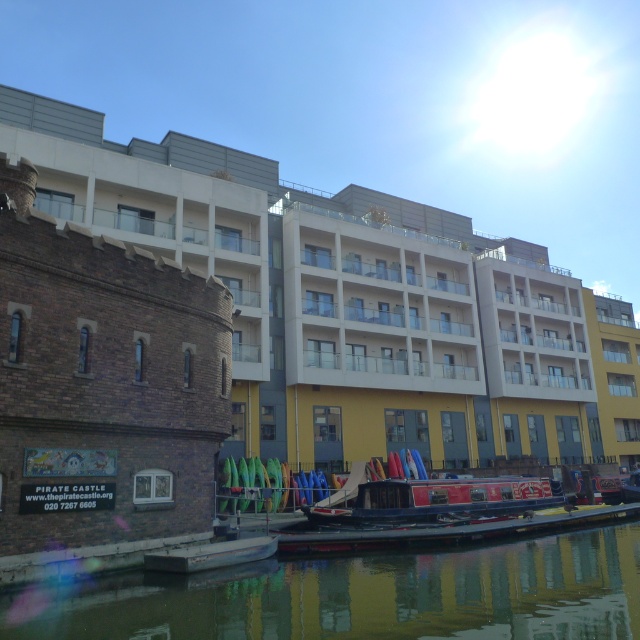
You are standing at the waterfront and want to throw a pebble into the smooth reflective water at center. If the pebble can travel 15 meters, will it reach the water?

The smooth reflective water at center is 13.56 meters away from the viewer. Since the pebble can travel 15 meters, which is farther than the distance to the water, the pebble will reach the smooth reflective water at center.

You are standing at point (362,595) in the scene. What is the object located at this point?

The object at point (362,595) is smooth reflective water at center.

You are a tour guide leading a group along the canal. You need to inform your group about the distance between the smooth reflective water at center and the blue polished wood barge at center. What do you tell them?

The smooth reflective water at center and the blue polished wood barge at center are 8.41 meters apart.